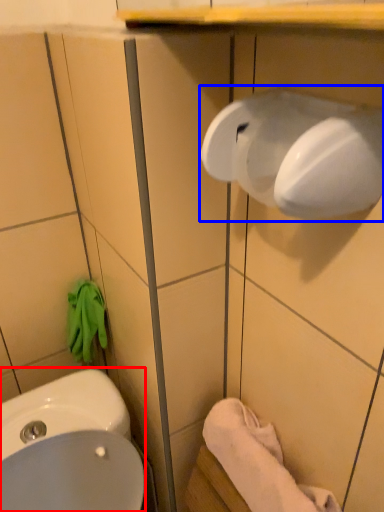
Question: Which point is further to the camera, sink (highlighted by a red box) or hand dryer (highlighted by a blue box)?

Choices:
 (A) sink
 (B) hand dryer

Answer: (A)